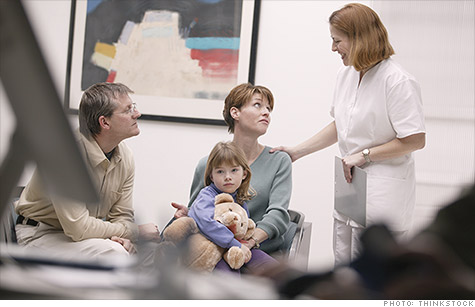
Locate an element on the screen. The width and height of the screenshot is (475, 307). clipboard is located at coordinates (350, 197).